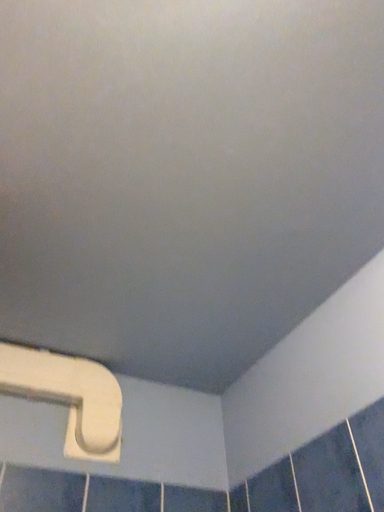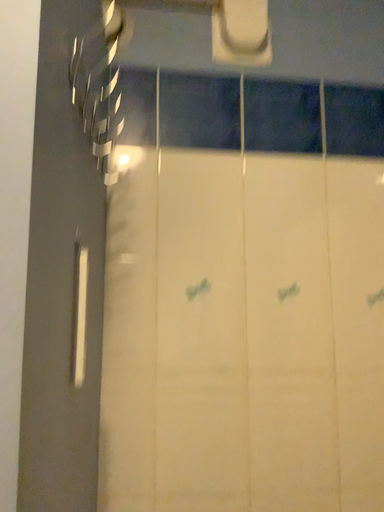
Question: Which way did the camera rotate in the video?

Choices:
 (A) rotated downward
 (B) rotated upward

Answer: (A)